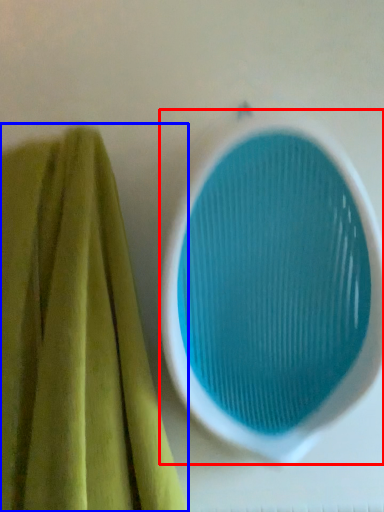
Question: Among these objects, which one is nearest to the camera, oval (highlighted by a red box) or towel (highlighted by a blue box)?

Choices:
 (A) oval
 (B) towel

Answer: (B)